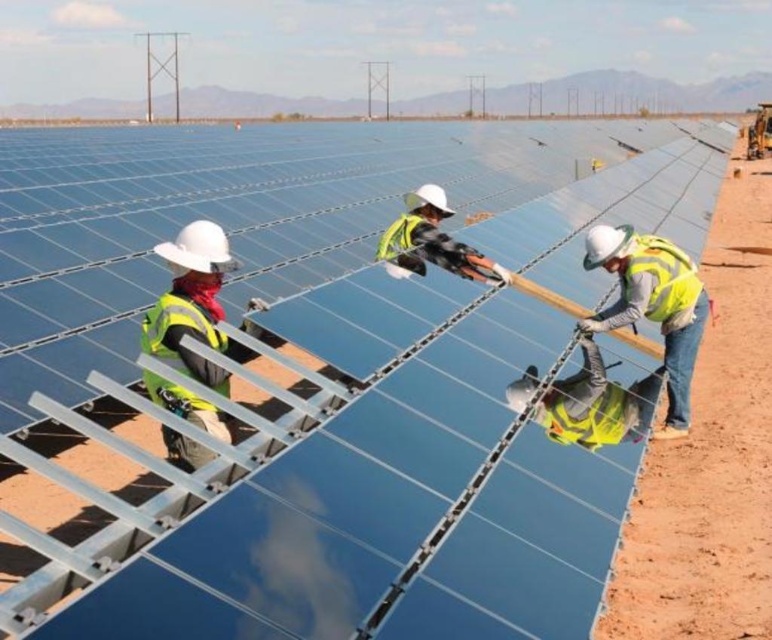
Question: Based on their relative distances, which object is farther from the reflective silver helmet at center?

Choices:
 (A) reflective yellow safety vest at center
 (B) yellow reflective vest at lower right
 (C) reflective yellow safety vest at left
 (D) yellow reflective vest at center

Answer: (C)

Question: Does yellow reflective vest at lower right have a greater width compared to reflective silver helmet at center?

Choices:
 (A) no
 (B) yes

Answer: (B)

Question: Is yellow reflective vest at center above yellow reflective vest at lower right?

Choices:
 (A) yes
 (B) no

Answer: (A)

Question: Is yellow reflective vest at lower right further to camera compared to reflective silver helmet at center?

Choices:
 (A) no
 (B) yes

Answer: (A)

Question: Which object is the closest to the reflective yellow safety vest at left?

Choices:
 (A) yellow reflective safety vest at right
 (B) reflective yellow safety vest at center
 (C) yellow reflective vest at lower right

Answer: (B)

Question: Which point is farther from the camera taking this photo?

Choices:
 (A) (251, 333)
 (B) (161, 348)
 (C) (405, 250)
 (D) (388, 252)

Answer: (D)